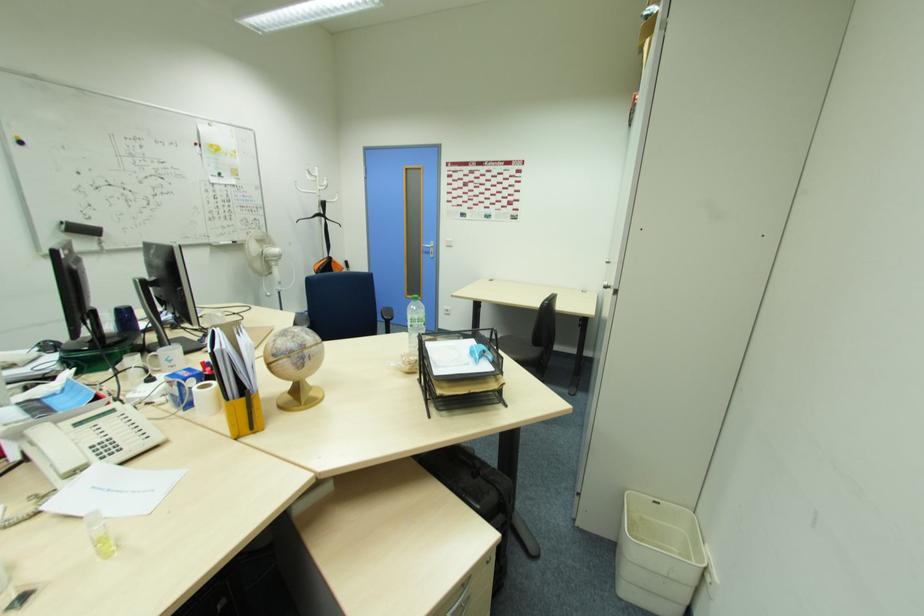
Locate an element on the screen. The width and height of the screenshot is (924, 616). telephone handset is located at coordinates (55, 448).